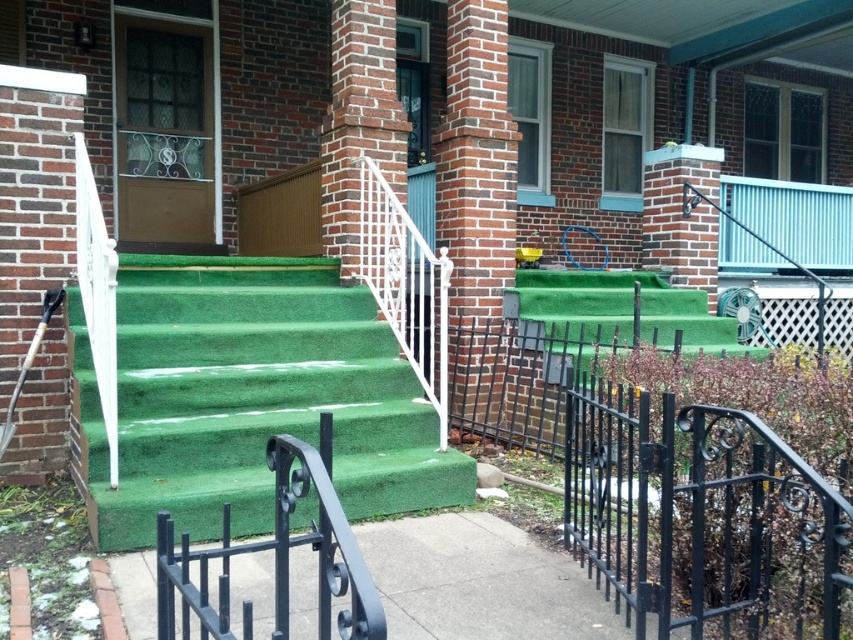
Based on the photo, you are standing on the sidewalk and want to approach the front door. Which object is closer to the path you should take, the green artificial turf at center or the black wrought iron railing at lower right?

The green artificial turf at center is closer to the path you should take because it is positioned to the left of the black wrought iron railing at lower right, meaning it is nearer to the entrance steps leading to the front door.

You are a delivery person trying to place a package on the steps leading to the front door. The package is 1 meter in height. Considering the green artificial turf at center and the black wrought iron at center, which object would you place the package on and why?

The green artificial turf at center is much taller than the black wrought iron at center. Therefore, the package should be placed on the green artificial turf at center because it can accommodate the height of the package.

You are standing at the entrance of the brick house and want to place a small potted plant. The potted plant must be placed exactly at the point marked by coordinates point (252, 396). What surface will the potted plant be placed on?

The point marked by coordinates point (252, 396) is located on the green artificial turf at center, so the potted plant will be placed on the green artificial turf at center.